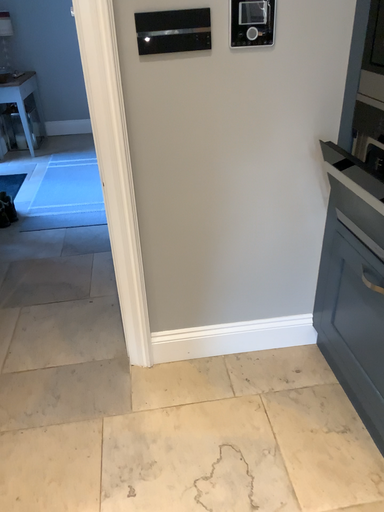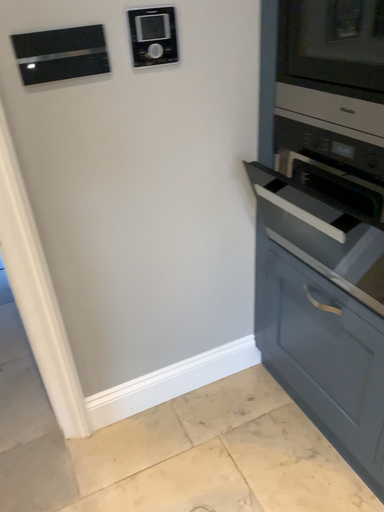
Question: How did the camera likely rotate when shooting the video?

Choices:
 (A) rotated left
 (B) rotated right

Answer: (B)